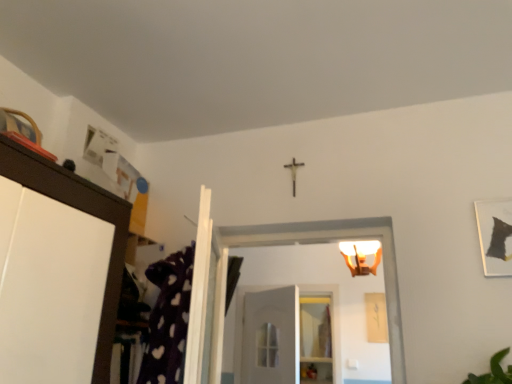
Question: Can we say white matte door at center lies outside matte white light fixture at upper center?

Choices:
 (A) yes
 (B) no

Answer: (A)

Question: Is white matte door at center positioned before matte white light fixture at upper center?

Choices:
 (A) yes
 (B) no

Answer: (B)

Question: From a real-world perspective, is white matte door at center under matte white light fixture at upper center?

Choices:
 (A) no
 (B) yes

Answer: (B)

Question: Is matte white light fixture at upper center a part of white matte door at center?

Choices:
 (A) no
 (B) yes

Answer: (A)

Question: From a real-world perspective, is white matte door at center located higher than matte white light fixture at upper center?

Choices:
 (A) yes
 (B) no

Answer: (B)

Question: In terms of width, does matte white light fixture at upper center look wider or thinner when compared to clear glass shelf at center?

Choices:
 (A) thin
 (B) wide

Answer: (A)

Question: From a real-world perspective, relative to clear glass shelf at center, is matte white light fixture at upper center vertically above or below?

Choices:
 (A) below
 (B) above

Answer: (B)

Question: Looking at the image, does matte white light fixture at upper center seem bigger or smaller compared to clear glass shelf at center?

Choices:
 (A) small
 (B) big

Answer: (A)

Question: In the image, is matte white light fixture at upper center positioned in front of or behind clear glass shelf at center?

Choices:
 (A) behind
 (B) front

Answer: (B)

Question: Is point (504, 223) positioned closer to the camera than point (352, 243)?

Choices:
 (A) closer
 (B) farther

Answer: (A)

Question: From a real-world perspective, is matte black picture frame at upper right above or below matte white light fixture at upper center?

Choices:
 (A) above
 (B) below

Answer: (B)

Question: Choose the correct answer: Is matte black picture frame at upper right inside matte white light fixture at upper center or outside it?

Choices:
 (A) inside
 (B) outside

Answer: (B)

Question: Is matte black picture frame at upper right bigger or smaller than matte white light fixture at upper center?

Choices:
 (A) small
 (B) big

Answer: (A)

Question: From a real-world perspective, relative to white matte door at center, is matte black picture frame at upper right vertically above or below?

Choices:
 (A) below
 (B) above

Answer: (B)

Question: Based on their positions, is matte black picture frame at upper right located to the left or right of white matte door at center?

Choices:
 (A) left
 (B) right

Answer: (B)